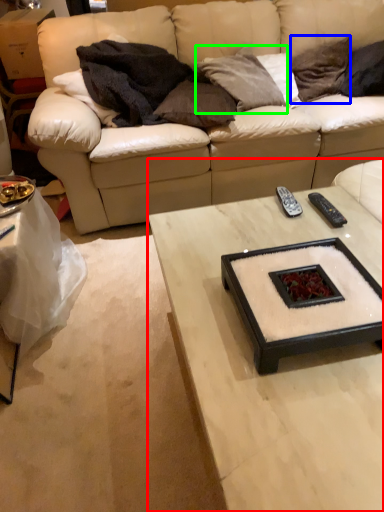
Question: Which is farther away from coffee table (highlighted by a red box)? pillow (highlighted by a blue box) or pillow (highlighted by a green box)?

Choices:
 (A) pillow
 (B) pillow

Answer: (A)